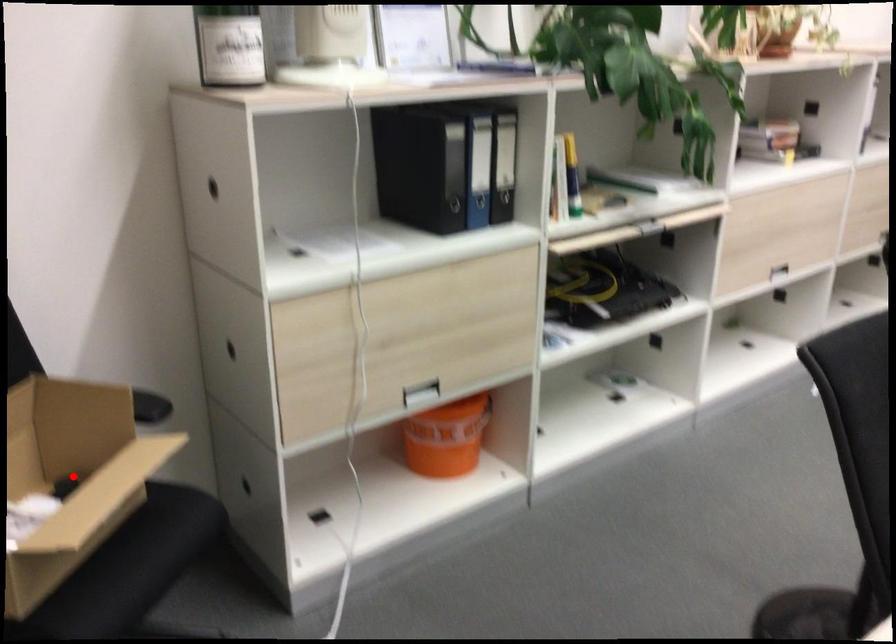
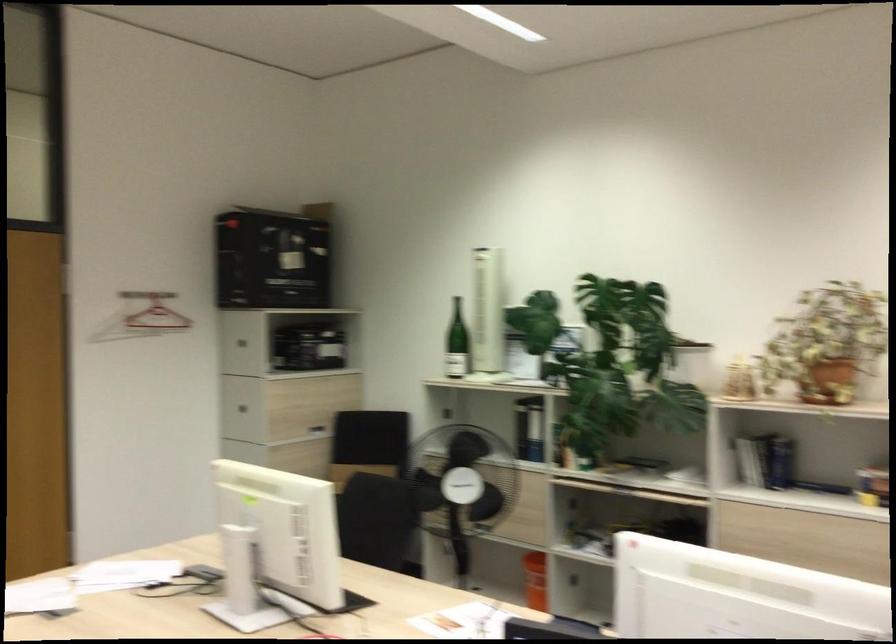
Question: I am providing you with two images of the same scene from different viewpoints. A red point is marked on the first image. At the location where the point appears in image 1, is it still visible in image 2?

Choices:
 (A) Yes
 (B) No

Answer: (B)